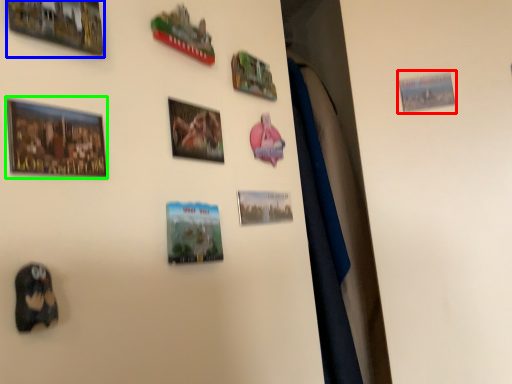
Question: Estimate the real-world distances between objects in this image. Which object is closer to picture frame (highlighted by a red box), picture frame (highlighted by a blue box) or picture frame (highlighted by a green box)?

Choices:
 (A) picture frame
 (B) picture frame

Answer: (A)